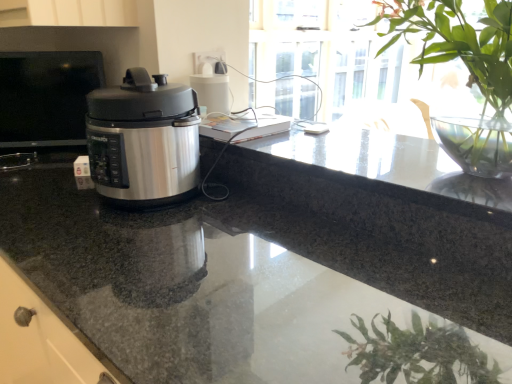
The width and height of the screenshot is (512, 384). Find the location of `free space above metallic silver pressure cooker at left (from a real-world perspective)`. free space above metallic silver pressure cooker at left (from a real-world perspective) is located at coordinates (40, 56).